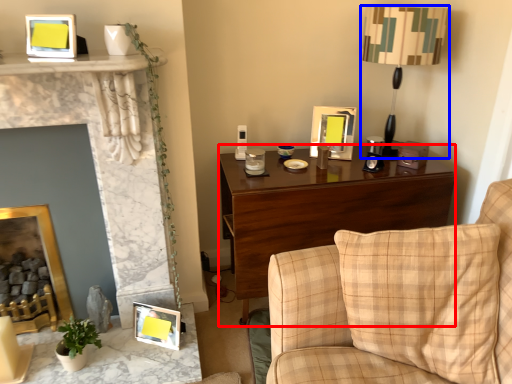
Question: Which object is further to the camera taking this photo, desk (highlighted by a red box) or table lamp (highlighted by a blue box)?

Choices:
 (A) desk
 (B) table lamp

Answer: (A)